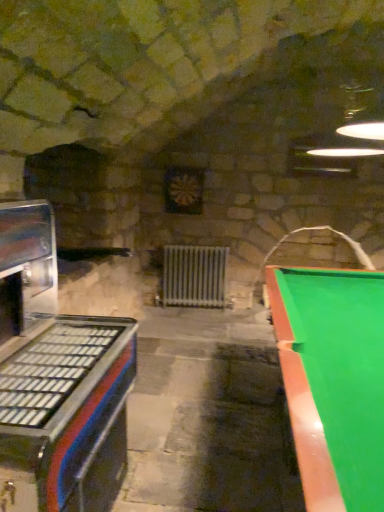
This screenshot has width=384, height=512. What are the coordinates of `metallic blue and red arcade machine at left` in the screenshot? It's located at (57, 380).

You are a GUI agent. You are given a task and a screenshot of the screen. Output one action in this format:
    pyautogui.click(x=<x>, y=<y>)
    Task: Click on the green glossy pool table at right
    The width and height of the screenshot is (384, 512).
    Given the screenshot: What is the action you would take?
    pyautogui.click(x=333, y=382)

Measure the distance between point (343, 486) and camera.

Point (343, 486) and camera are 86.30 centimeters apart.

Describe the element at coordinates (194, 276) in the screenshot. I see `white metallic radiator at center` at that location.

Where is `metallic blue and red arcade machine at left`? This screenshot has height=512, width=384. metallic blue and red arcade machine at left is located at coordinates (57, 380).

Is there a large distance between green glossy pool table at right and white metallic radiator at center?

Yes, green glossy pool table at right and white metallic radiator at center are quite far apart.

Is green glossy pool table at right not within white metallic radiator at center?

Yes, green glossy pool table at right is located beyond the bounds of white metallic radiator at center.

In the scene shown: Can you tell me how much green glossy pool table at right and white metallic radiator at center differ in facing direction?

The angular difference between green glossy pool table at right and white metallic radiator at center is 86.4 degrees.

From the picture: From the image's perspective, who appears lower, white metallic radiator at center or green glossy pool table at right?

green glossy pool table at right.

Would you say green glossy pool table at right is part of white metallic radiator at center's contents?

No, green glossy pool table at right is located outside of white metallic radiator at center.

Does white metallic radiator at center have a greater width compared to green glossy pool table at right?

In fact, white metallic radiator at center might be narrower than green glossy pool table at right.

Are white metallic radiator at center and green glossy pool table at right far apart?

white metallic radiator at center is positioned a significant distance from green glossy pool table at right.

Between metallic blue and red arcade machine at left and green glossy pool table at right, which one appears on the right side from the viewer's perspective?

green glossy pool table at right is more to the right.

Is metallic blue and red arcade machine at left with green glossy pool table at right?

They are not placed beside each other.

Is the depth of metallic blue and red arcade machine at left less than that of green glossy pool table at right?

No, metallic blue and red arcade machine at left is behind green glossy pool table at right.

Is metallic blue and red arcade machine at left at the left side of white metallic radiator at center?

Yes.

Does point (66, 335) come farther from viewer compared to point (194, 272)?

That is False.

Which object is further away from the camera taking this photo, white metallic radiator at center or metallic blue and red arcade machine at left?

white metallic radiator at center is more distant.

Is white metallic radiator at center turned away from metallic blue and red arcade machine at left?

No, white metallic radiator at center's orientation is not away from metallic blue and red arcade machine at left.

Is white metallic radiator at center next to metallic blue and red arcade machine at left?

No, white metallic radiator at center is not beside metallic blue and red arcade machine at left.

Looking at the image, does green glossy pool table at right seem bigger or smaller compared to metallic blue and red arcade machine at left?

Clearly, green glossy pool table at right is larger in size than metallic blue and red arcade machine at left.

From the image's perspective, which object appears higher, green glossy pool table at right or metallic blue and red arcade machine at left?

metallic blue and red arcade machine at left.

Does green glossy pool table at right appear on the right side of metallic blue and red arcade machine at left?

Yes.

The width and height of the screenshot is (384, 512). I want to click on radiator below the green glossy pool table at right (from a real-world perspective), so click(x=194, y=276).

Where is `radiator on the left of green glossy pool table at right`? radiator on the left of green glossy pool table at right is located at coordinates (194, 276).

When comparing their distances from green glossy pool table at right, does white metallic radiator at center or metallic blue and red arcade machine at left seem closer?

metallic blue and red arcade machine at left is positioned closer to the anchor green glossy pool table at right.

Which object lies further to the anchor point metallic blue and red arcade machine at left, white metallic radiator at center or green glossy pool table at right?

white metallic radiator at center.

When comparing their distances from white metallic radiator at center, does metallic blue and red arcade machine at left or green glossy pool table at right seem further?

The object further to white metallic radiator at center is metallic blue and red arcade machine at left.

Based on their spatial positions, is green glossy pool table at right or white metallic radiator at center further from metallic blue and red arcade machine at left?

The object further to metallic blue and red arcade machine at left is white metallic radiator at center.

Which object lies further to the anchor point green glossy pool table at right, metallic blue and red arcade machine at left or white metallic radiator at center?

white metallic radiator at center is positioned further to the anchor green glossy pool table at right.

Estimate the real-world distances between objects in this image. Which object is closer to white metallic radiator at center, green glossy pool table at right or metallic blue and red arcade machine at left?

Among the two, green glossy pool table at right is located nearer to white metallic radiator at center.

The image size is (384, 512). Identify the location of appliance between green glossy pool table at right and white metallic radiator at center from front to back. (57, 380).